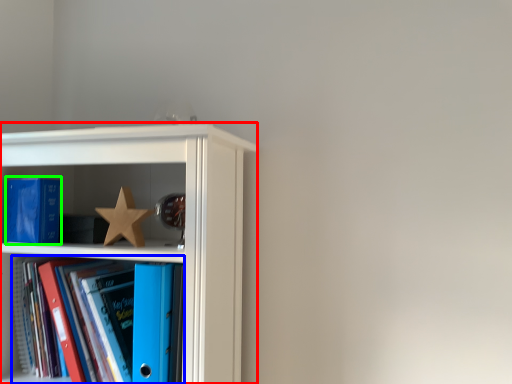
Question: Based on their relative distances, which object is nearer to shelf (highlighted by a red box)? Choose from book (highlighted by a blue box) and paperback book (highlighted by a green box).

Choices:
 (A) book
 (B) paperback book

Answer: (A)